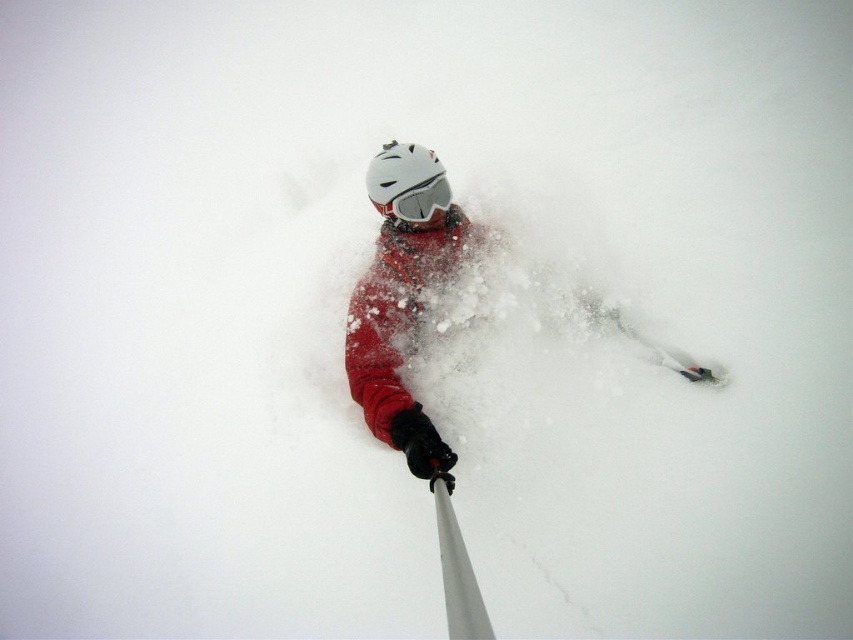
Between point (383, 211) and point (454, 620), which one is positioned in front?

Positioned in front is point (454, 620).

Does matte red snowboarder at center have a greater height compared to silver metallic ski pole at lower center?

Yes.

Between point (390, 186) and point (471, 570), which one is positioned in front?

Positioned in front is point (471, 570).

This screenshot has width=853, height=640. What are the coordinates of `matte red snowboarder at center` in the screenshot? It's located at (402, 296).

Where is `matte red snowboarder at center`? The height and width of the screenshot is (640, 853). matte red snowboarder at center is located at coordinates (402, 296).

Does matte red snowboarder at center come behind white matte helmet at center?

No, it is in front of white matte helmet at center.

I want to click on matte red snowboarder at center, so click(402, 296).

The image size is (853, 640). What are the coordinates of `matte red snowboarder at center` in the screenshot? It's located at (402, 296).

Does white matte helmet at center come behind silver metallic ski pole at lower center?

Yes.

Between point (381, 160) and point (480, 604), which one is positioned behind?

The point (381, 160) is behind.

Is point (374, 173) farther from viewer compared to point (456, 620)?

Yes, it is.

The image size is (853, 640). I want to click on white matte helmet at center, so click(x=407, y=182).